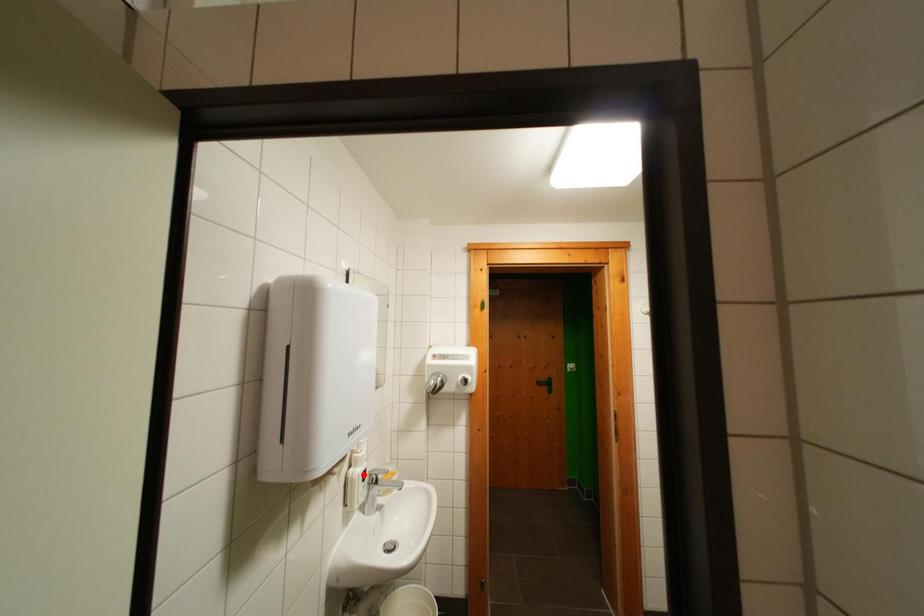
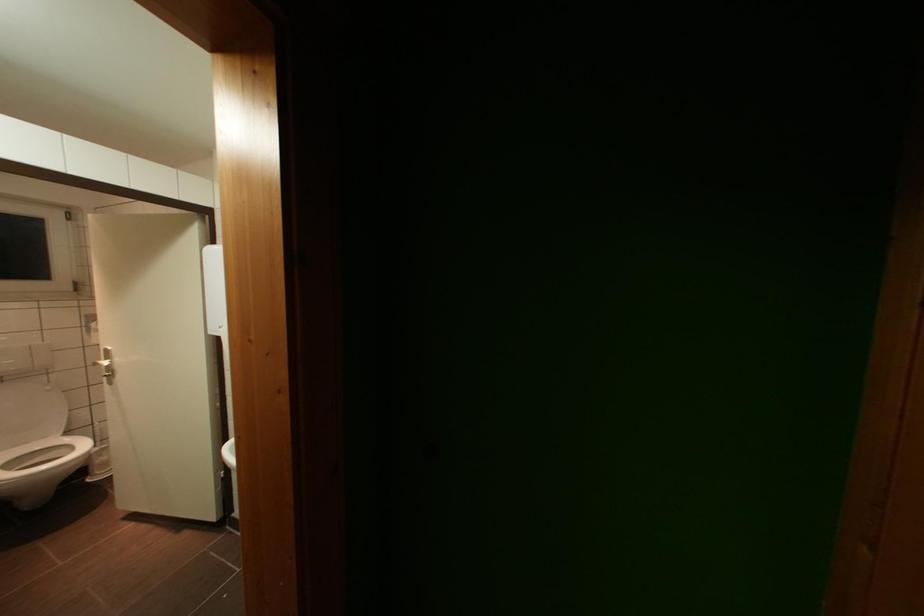
Question: I am providing you with two images of the same scene from different viewpoints. A red point is marked on the first image. At the location where the point appears in image 1, is it still visible in image 2?

Choices:
 (A) Yes
 (B) No

Answer: (B)